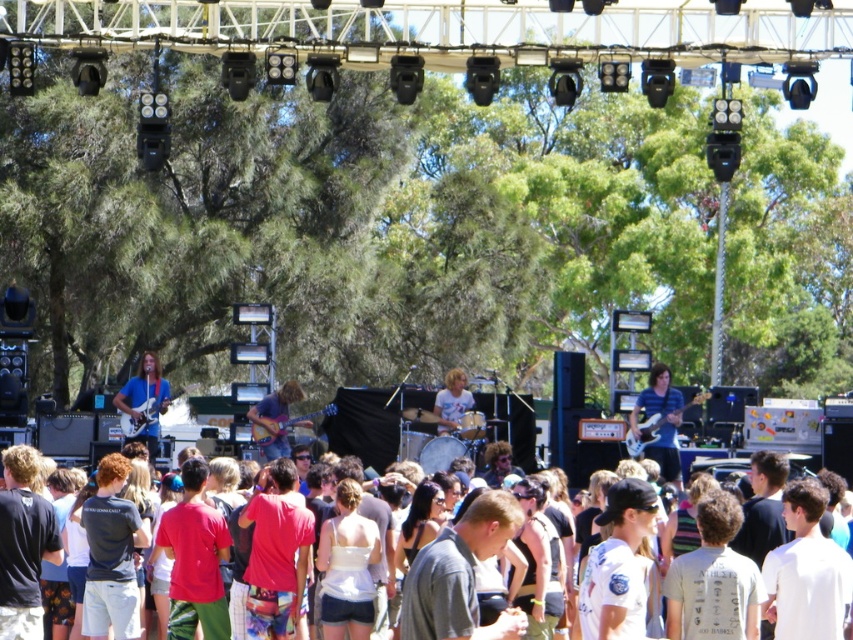
Question: Which is farther from the shiny brown guitar at center?

Choices:
 (A) shiny blue guitar at center
 (B) white cotton shirt at center
 (C) light blue denim shirt at center

Answer: (B)

Question: Where is striped shirt at center located in relation to shiny brown guitar at center in the image?

Choices:
 (A) left
 (B) right

Answer: (B)

Question: Where is striped shirt at center located in relation to shiny brown guitar at center in the image?

Choices:
 (A) right
 (B) left

Answer: (A)

Question: Which point is farther from the camera taking this photo?

Choices:
 (A) (129, 406)
 (B) (666, 435)
 (C) (287, 397)

Answer: (C)

Question: Which of the following is the farthest from the observer?

Choices:
 (A) striped shirt at center
 (B) shiny blue guitar at center

Answer: (B)

Question: Considering the relative positions of white cotton shirt at center and striped shirt at center in the image provided, where is white cotton shirt at center located with respect to striped shirt at center?

Choices:
 (A) left
 (B) right

Answer: (A)